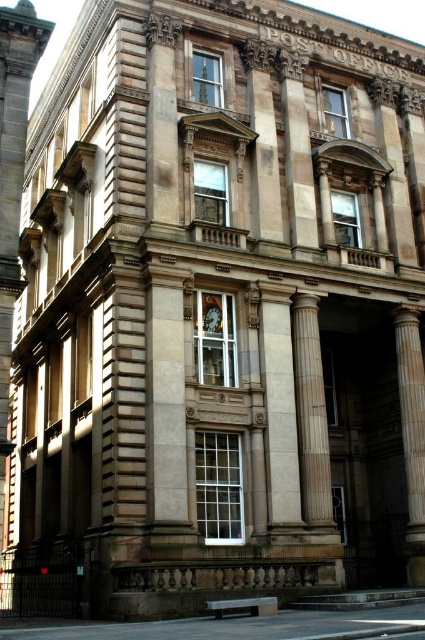
Based on the photo, you are standing in front of the grand classical building. You need to locate the white marble pillar at center. Where exactly is it positioned in terms of coordinates?

The white marble pillar at center is positioned at coordinates point (278,404).